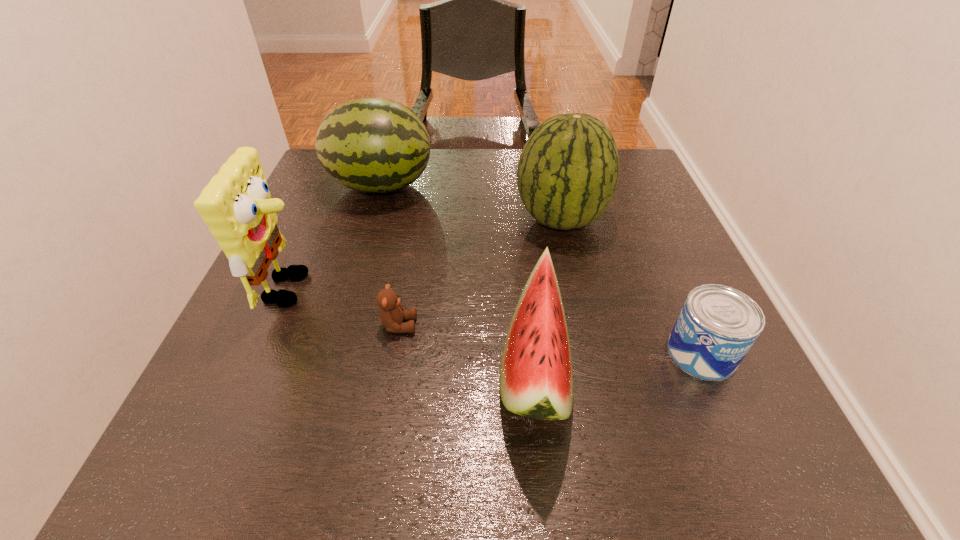
Locate an element on the screen. free location located 0.250m on the outer rind of the shortest watermelon is located at coordinates (352, 369).

The width and height of the screenshot is (960, 540). In order to click on vacant space positioned 0.050m on the outer rind of the shortest watermelon in this screenshot , I will do `click(469, 369)`.

Image resolution: width=960 pixels, height=540 pixels. In order to click on free space located 0.050m on the front label of the fifth tallest object in this screenshot , I will do `click(726, 408)`.

Locate an element on the screen. The image size is (960, 540). vacant space located on the face of the teddy bear is located at coordinates (443, 325).

Locate an element on the screen. The height and width of the screenshot is (540, 960). object at the near edge is located at coordinates 536,376.

Locate an element on the screen. The height and width of the screenshot is (540, 960). sponge located in the left edge section of the desktop is located at coordinates (236, 205).

The width and height of the screenshot is (960, 540). I want to click on watermelon that is positioned at the left edge, so click(x=373, y=145).

This screenshot has width=960, height=540. What are the coordinates of `watermelon present at the right edge` in the screenshot? It's located at (567, 174).

I want to click on can positioned at the right edge, so click(x=717, y=326).

Locate an element on the screen. This screenshot has height=540, width=960. object present at the far left corner is located at coordinates (373, 145).